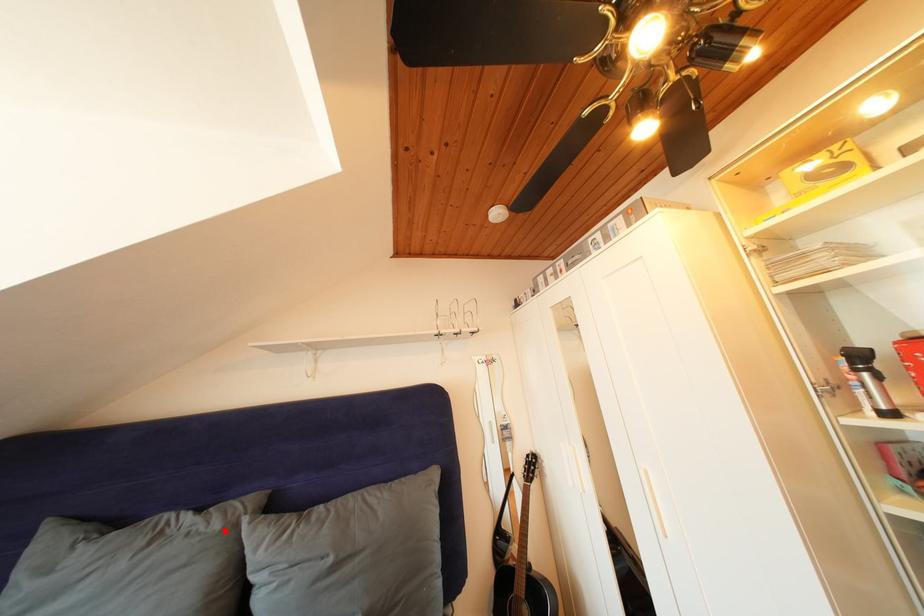
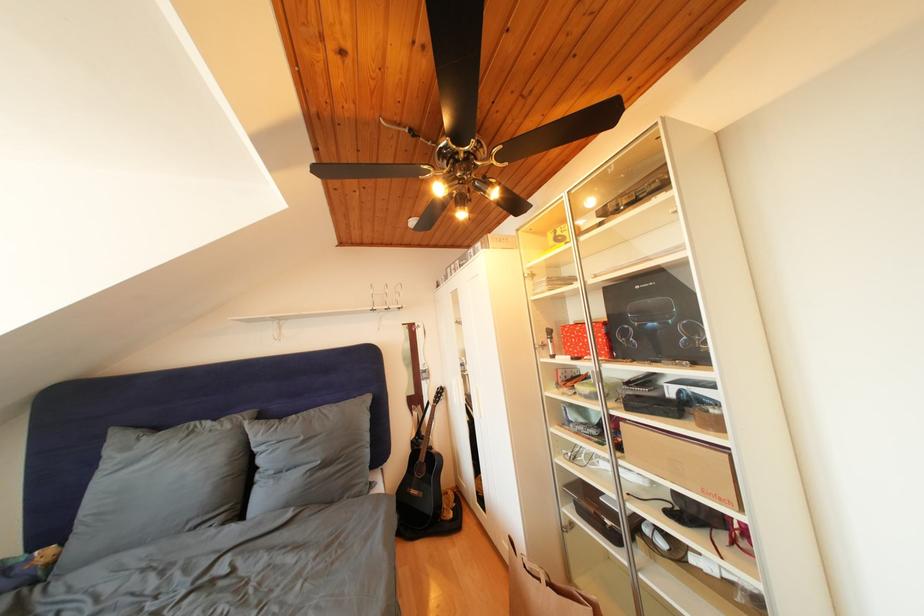
Where in the second image is the point corresponding to the highlighted location from the first image?

(236, 432)